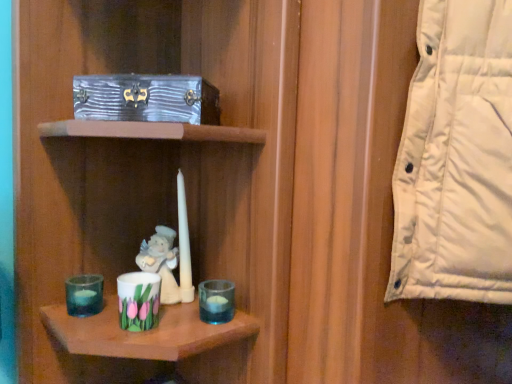
The image size is (512, 384). What do you see at coordinates (138, 300) in the screenshot?
I see `porcelain floral cup at lower center, arranged as the 2th candle holder when viewed from the left` at bounding box center [138, 300].

The image size is (512, 384). What do you see at coordinates (184, 244) in the screenshot?
I see `white matte birthday candle at center` at bounding box center [184, 244].

This screenshot has width=512, height=384. What do you see at coordinates (216, 301) in the screenshot? I see `transparent glass candle holder at lower center, arranged as the 1th candle holder when viewed from the right` at bounding box center [216, 301].

Measure the distance between transparent glass candle holder at lower center, arranged as the 1th candle holder when viewed from the right, and camera.

The depth of transparent glass candle holder at lower center, arranged as the 1th candle holder when viewed from the right, is 69.67 centimeters.

What are the coordinates of `transparent glass candle holder at lower left, acting as the first candle holder starting from the left` in the screenshot? It's located at pyautogui.click(x=84, y=295).

What are the coordinates of `metallic silver box at upper left` in the screenshot? It's located at (146, 98).

What's the angular difference between porcelain angel at center and transparent glass candle holder at lower left, the 3th candle holder when ordered from right to left,'s facing directions?

3.91 degrees separate the facing orientations of porcelain angel at center and transparent glass candle holder at lower left, the 3th candle holder when ordered from right to left.

Which object is further away from the camera, porcelain angel at center or transparent glass candle holder at lower left, the 3th candle holder when ordered from right to left?

porcelain angel at center is further away from the camera.

This screenshot has width=512, height=384. I want to click on figurine that appears above the transparent glass candle holder at lower left, the 3th candle holder when ordered from right to left (from a real-world perspective), so click(x=164, y=265).

Is porcelain angel at center beside transparent glass candle holder at lower left, the 3th candle holder when ordered from right to left?

No, porcelain angel at center is not with transparent glass candle holder at lower left, the 3th candle holder when ordered from right to left.

From a real-world perspective, is porcelain angel at center over white matte birthday candle at center?

No, from a real-world perspective, porcelain angel at center is not over white matte birthday candle at center

How much distance is there between porcelain angel at center and white matte birthday candle at center?

A distance of 1.54 inches exists between porcelain angel at center and white matte birthday candle at center.

Is porcelain angel at center inside or outside of white matte birthday candle at center?

porcelain angel at center is outside white matte birthday candle at center.

Which is in front, porcelain angel at center or white matte birthday candle at center?

porcelain angel at center is closer to the camera.

Identify the location of birthday candle that is on the right side of porcelain floral cup at lower center, placed as the 2th candle holder when sorted from right to left. This screenshot has height=384, width=512. (184, 244).

From a real-world perspective, is white matte birthday candle at center positioned under porcelain floral cup at lower center, placed as the 2th candle holder when sorted from right to left, based on gravity?

Incorrect, from a real-world perspective, white matte birthday candle at center is higher than porcelain floral cup at lower center, placed as the 2th candle holder when sorted from right to left.

Is white matte birthday candle at center not inside porcelain floral cup at lower center, arranged as the 2th candle holder when viewed from the left?

Yes.

Considering the sizes of objects transparent glass candle holder at lower left, acting as the first candle holder starting from the left, and metallic silver box at upper left in the image provided, who is bigger, transparent glass candle holder at lower left, acting as the first candle holder starting from the left, or metallic silver box at upper left?

metallic silver box at upper left is bigger.

How different are the orientations of transparent glass candle holder at lower left, acting as the first candle holder starting from the left, and metallic silver box at upper left in degrees?

transparent glass candle holder at lower left, acting as the first candle holder starting from the left, and metallic silver box at upper left are facing 10.3 degrees away from each other.

Is transparent glass candle holder at lower left, acting as the first candle holder starting from the left, shorter than metallic silver box at upper left?

Indeed, transparent glass candle holder at lower left, acting as the first candle holder starting from the left, has a lesser height compared to metallic silver box at upper left.

Considering the relative positions of transparent glass candle holder at lower left, the 3th candle holder when ordered from right to left, and metallic silver box at upper left in the image provided, is transparent glass candle holder at lower left, the 3th candle holder when ordered from right to left, to the left or to the right of metallic silver box at upper left?

Based on their positions, transparent glass candle holder at lower left, the 3th candle holder when ordered from right to left, is located to the left of metallic silver box at upper left.

How different are the orientations of transparent glass candle holder at lower center, the 3th candle holder viewed from the left, and metallic silver box at upper left in degrees?

18.7 degrees separate the facing orientations of transparent glass candle holder at lower center, the 3th candle holder viewed from the left, and metallic silver box at upper left.

Looking at this image, is metallic silver box at upper left located within transparent glass candle holder at lower center, the 3th candle holder viewed from the left?

No, metallic silver box at upper left is not a part of transparent glass candle holder at lower center, the 3th candle holder viewed from the left.

How far apart are transparent glass candle holder at lower center, arranged as the 1th candle holder when viewed from the right, and metallic silver box at upper left?

A distance of 13.36 inches exists between transparent glass candle holder at lower center, arranged as the 1th candle holder when viewed from the right, and metallic silver box at upper left.

Is transparent glass candle holder at lower center, the 3th candle holder viewed from the left, oriented towards metallic silver box at upper left?

No, transparent glass candle holder at lower center, the 3th candle holder viewed from the left, is not oriented towards metallic silver box at upper left.

Is porcelain floral cup at lower center, arranged as the 2th candle holder when viewed from the left, taller than transparent glass candle holder at lower center, arranged as the 1th candle holder when viewed from the right?

Yes.

In the scene shown: Are porcelain floral cup at lower center, arranged as the 2th candle holder when viewed from the left, and transparent glass candle holder at lower center, the 3th candle holder viewed from the left, far apart?

Actually, porcelain floral cup at lower center, arranged as the 2th candle holder when viewed from the left, and transparent glass candle holder at lower center, the 3th candle holder viewed from the left, are a little close together.

I want to click on candle holder in front of the transparent glass candle holder at lower center, the 3th candle holder viewed from the left, so click(138, 300).

Who is smaller, porcelain floral cup at lower center, arranged as the 2th candle holder when viewed from the left, or metallic silver box at upper left?

porcelain floral cup at lower center, arranged as the 2th candle holder when viewed from the left, is smaller.

Is point (133, 291) farther from viewer compared to point (202, 89)?

No.

Is metallic silver box at upper left surrounded by porcelain floral cup at lower center, arranged as the 2th candle holder when viewed from the left?

Definitely not — metallic silver box at upper left is not inside porcelain floral cup at lower center, arranged as the 2th candle holder when viewed from the left.

How many degrees apart are the facing directions of porcelain floral cup at lower center, arranged as the 2th candle holder when viewed from the left, and metallic silver box at upper left?

They differ by 12.6 degrees in their facing directions.

There is a porcelain angel at center. Where is `the 1st candle holder below it (from the image's perspective)`? The image size is (512, 384). the 1st candle holder below it (from the image's perspective) is located at coordinates (84, 295).

This screenshot has height=384, width=512. I want to click on birthday candle that appears above the porcelain angel at center (from a real-world perspective), so click(184, 244).

Considering their positions, is transparent glass candle holder at lower center, the 3th candle holder viewed from the left, positioned further to metallic silver box at upper left than transparent glass candle holder at lower left, the 3th candle holder when ordered from right to left?

transparent glass candle holder at lower left, the 3th candle holder when ordered from right to left, lies further to metallic silver box at upper left than the other object.

Which object lies nearer to the anchor point transparent glass candle holder at lower left, the 3th candle holder when ordered from right to left, metallic silver box at upper left or porcelain angel at center?

porcelain angel at center is positioned closer to the anchor transparent glass candle holder at lower left, the 3th candle holder when ordered from right to left.

Considering their positions, is porcelain floral cup at lower center, placed as the 2th candle holder when sorted from right to left, positioned further to white matte birthday candle at center than transparent glass candle holder at lower left, the 3th candle holder when ordered from right to left?

Based on the image, transparent glass candle holder at lower left, the 3th candle holder when ordered from right to left, appears to be further to white matte birthday candle at center.

From the image, which object appears to be farther from porcelain angel at center, metallic silver box at upper left or white matte birthday candle at center?

The object further to porcelain angel at center is metallic silver box at upper left.

Looking at the image, which one is located closer to porcelain angel at center, transparent glass candle holder at lower center, arranged as the 1th candle holder when viewed from the right, or metallic silver box at upper left?

transparent glass candle holder at lower center, arranged as the 1th candle holder when viewed from the right, is positioned closer to the anchor porcelain angel at center.

Considering their positions, is porcelain angel at center positioned further to transparent glass candle holder at lower center, the 3th candle holder viewed from the left, than metallic silver box at upper left?

metallic silver box at upper left.

Looking at the image, which one is located closer to transparent glass candle holder at lower left, the 3th candle holder when ordered from right to left, metallic silver box at upper left or porcelain floral cup at lower center, arranged as the 2th candle holder when viewed from the left?

porcelain floral cup at lower center, arranged as the 2th candle holder when viewed from the left, is closer to transparent glass candle holder at lower left, the 3th candle holder when ordered from right to left.

Considering their positions, is metallic silver box at upper left positioned closer to transparent glass candle holder at lower center, arranged as the 1th candle holder when viewed from the right, than white matte birthday candle at center?

The object closer to transparent glass candle holder at lower center, arranged as the 1th candle holder when viewed from the right, is white matte birthday candle at center.

Where is `birthday candle located between porcelain angel at center and transparent glass candle holder at lower center, the 3th candle holder viewed from the left, in the left-right direction`? birthday candle located between porcelain angel at center and transparent glass candle holder at lower center, the 3th candle holder viewed from the left, in the left-right direction is located at coordinates (184, 244).

Where is `figurine between transparent glass candle holder at lower left, acting as the first candle holder starting from the left, and transparent glass candle holder at lower center, arranged as the 1th candle holder when viewed from the right, in the horizontal direction`? Image resolution: width=512 pixels, height=384 pixels. figurine between transparent glass candle holder at lower left, acting as the first candle holder starting from the left, and transparent glass candle holder at lower center, arranged as the 1th candle holder when viewed from the right, in the horizontal direction is located at coordinates (164, 265).

At what (x,y) coordinates should I click in order to perform the action: click on figurine between transparent glass candle holder at lower left, acting as the first candle holder starting from the left, and white matte birthday candle at center from left to right. Please return your answer as a coordinate pair (x, y). Looking at the image, I should click on (164, 265).

Locate an element on the screen. The height and width of the screenshot is (384, 512). birthday candle located between transparent glass candle holder at lower left, the 3th candle holder when ordered from right to left, and transparent glass candle holder at lower center, arranged as the 1th candle holder when viewed from the right, in the left-right direction is located at coordinates (184, 244).